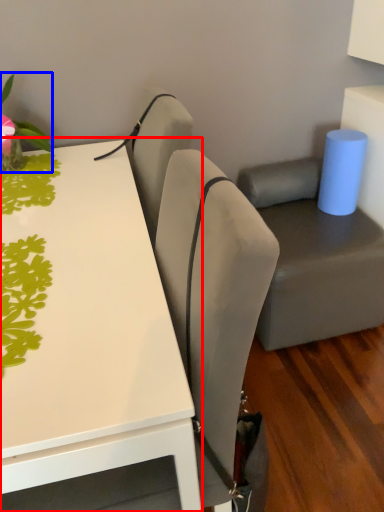
Question: Which object appears closest to the camera in this image, table (highlighted by a red box) or plant (highlighted by a blue box)?

Choices:
 (A) table
 (B) plant

Answer: (A)